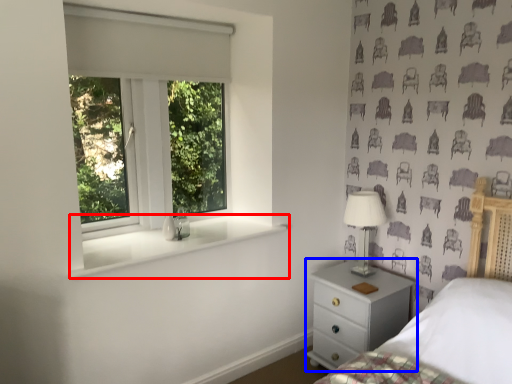
Question: Which of the following is the farthest to the observer, window sill (highlighted by a red box) or chest of drawers (highlighted by a blue box)?

Choices:
 (A) window sill
 (B) chest of drawers

Answer: (B)